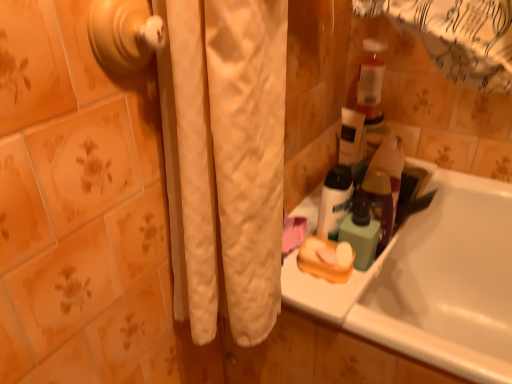
Question: Would you say gold metallic door handle at upper left is to the left or to the right of white glossy bathtub at lower right in the picture?

Choices:
 (A) right
 (B) left

Answer: (B)

Question: From the image's perspective, is gold metallic door handle at upper left positioned above or below white glossy bathtub at lower right?

Choices:
 (A) below
 (B) above

Answer: (B)

Question: Based on their relative distances, which object is nearer to the gold metallic door handle at upper left?

Choices:
 (A) translucent plastic bottle at upper right
 (B) green matte bottle at upper right
 (C) white glossy bathtub at lower right
 (D) white matte bottle at upper right
 (E) orange matte soap dish at center

Answer: (D)

Question: Estimate the real-world distances between objects in this image. Which object is farther from the white plastic sink at lower right?

Choices:
 (A) translucent plastic bottle at upper right
 (B) orange matte soap dish at center
 (C) gold metallic door handle at upper left
 (D) green matte bottle at upper right
 (E) white matte bottle at upper right

Answer: (C)